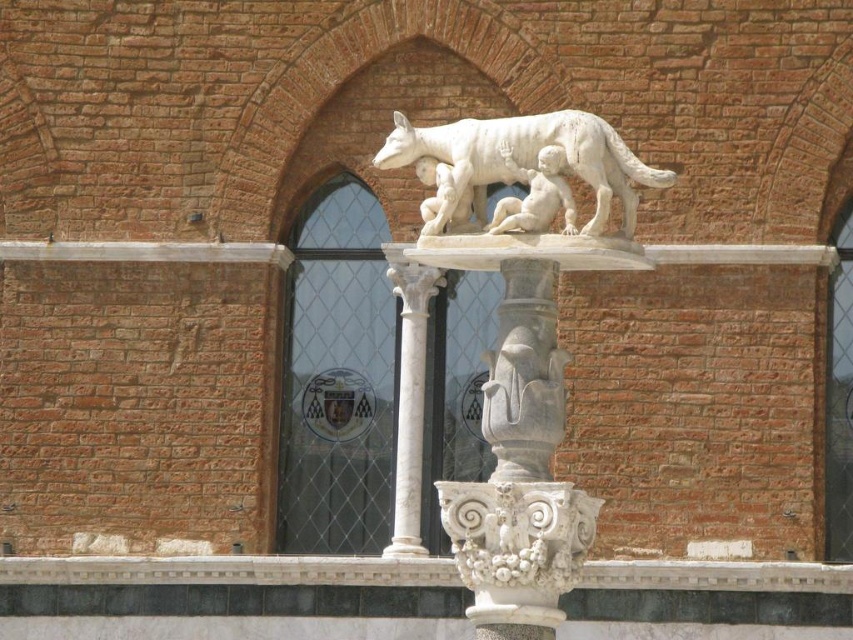
Which is more to the right, white marble wolf at center or white marble column at center?

From the viewer's perspective, white marble wolf at center appears more on the right side.

Does point (483, 184) come closer to viewer compared to point (399, 538)?

Yes, point (483, 184) is closer to viewer.

At what (x,y) coordinates should I click in order to perform the action: click on white marble wolf at center. Please return your answer as a coordinate pair (x, y). Looking at the image, I should click on (524, 157).

Which is more to the right, white marble wolf at center or white marble baby at upper center?

white marble baby at upper center

Find the location of a particular element. white marble wolf at center is located at coordinates (524, 157).

Between white marble column at center and white marble baby at upper center, which one has more height?

white marble column at center

Is white marble column at center to the right of white marble baby at upper center from the viewer's perspective?

Incorrect, white marble column at center is not on the right side of white marble baby at upper center.

Between point (416, 456) and point (514, 230), which one is positioned in front?

Positioned in front is point (514, 230).

Image resolution: width=853 pixels, height=640 pixels. Identify the location of white marble column at center. (409, 396).